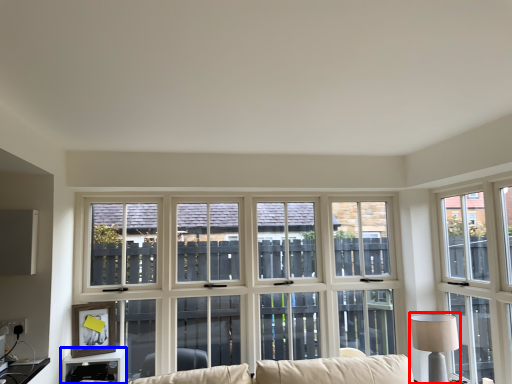
Question: Which of the following is the closest to the observer, table lamp (highlighted by a red box) or table (highlighted by a blue box)?

Choices:
 (A) table lamp
 (B) table

Answer: (B)